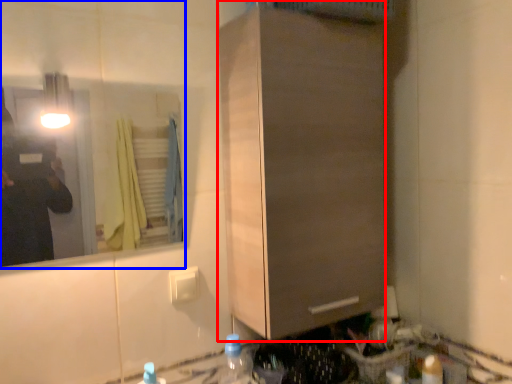
Question: Which of the following is the closest to the observer, cabinetry (highlighted by a red box) or mirror (highlighted by a blue box)?

Choices:
 (A) cabinetry
 (B) mirror

Answer: (B)